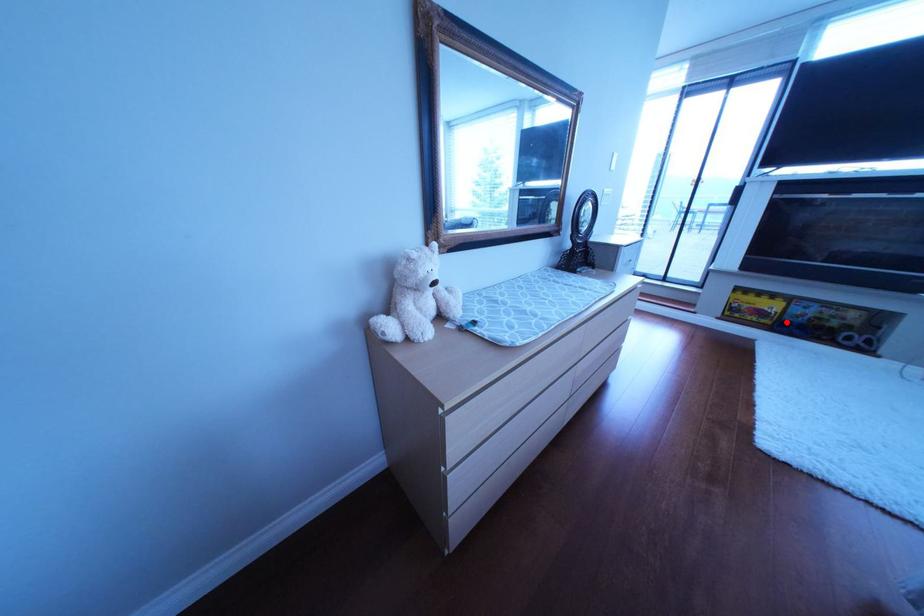
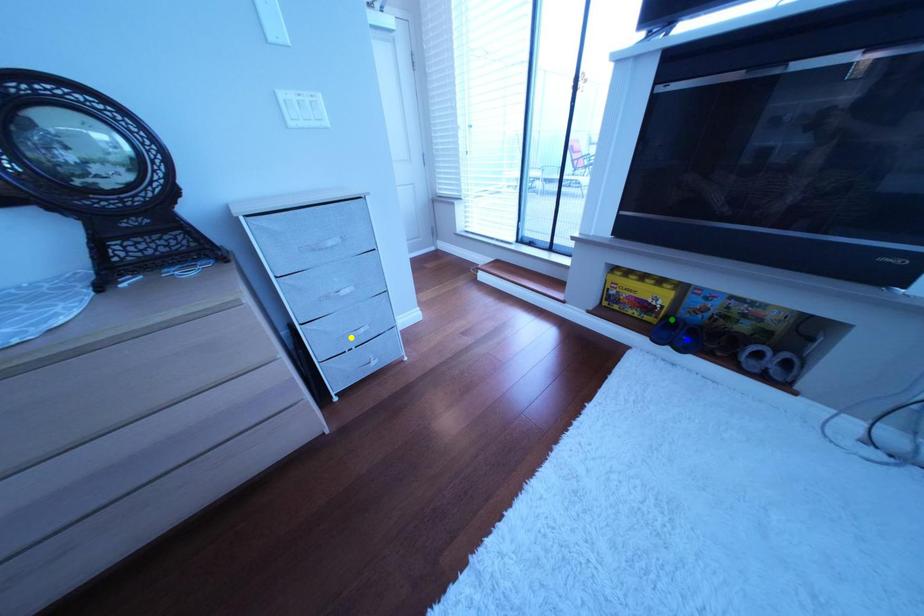
Question: I am providing you with two images of the same scene from different viewpoints. A red point is marked on the first image. You are given multiple points on the second image. In image 2, which mark is for the same physical point as the one in image 1?

Choices:
 (A) green point
 (B) yellow point
 (C) blue point

Answer: (A)